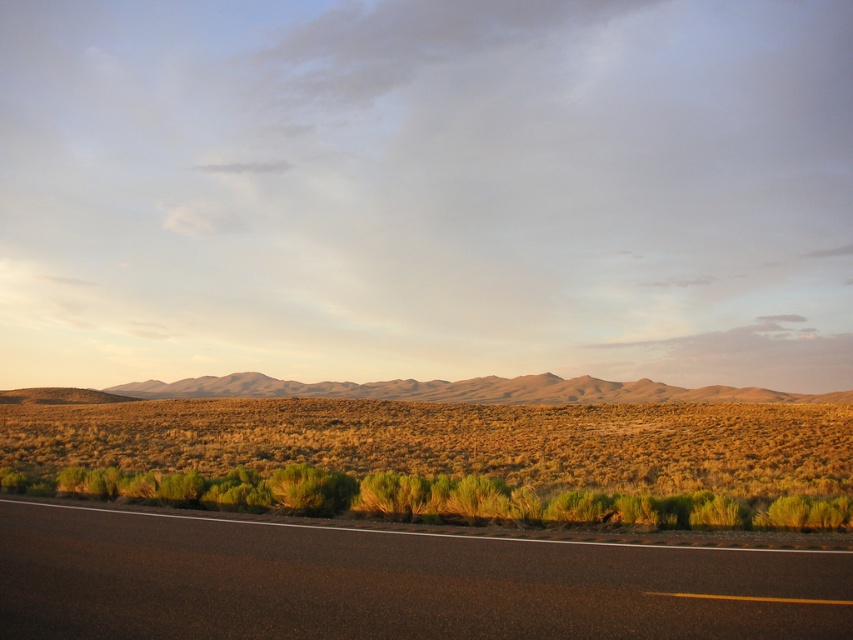
Question: Is green shrubs at lower center bigger than black asphalt road at lower left?

Choices:
 (A) yes
 (B) no

Answer: (A)

Question: Which object appears closest to the camera in this image?

Choices:
 (A) black asphalt road at lower left
 (B) green shrubs at lower center

Answer: (A)

Question: Which of the following is the farthest from the observer?

Choices:
 (A) green shrubs at lower center
 (B) black asphalt road at lower left

Answer: (A)

Question: Which point appears farthest from the camera in this image?

Choices:
 (A) (102, 509)
 (B) (198, 468)

Answer: (B)

Question: Does green shrubs at lower center come in front of black asphalt road at lower left?

Choices:
 (A) no
 (B) yes

Answer: (A)

Question: Can you confirm if green shrubs at lower center is positioned to the left of black asphalt road at lower left?

Choices:
 (A) no
 (B) yes

Answer: (A)